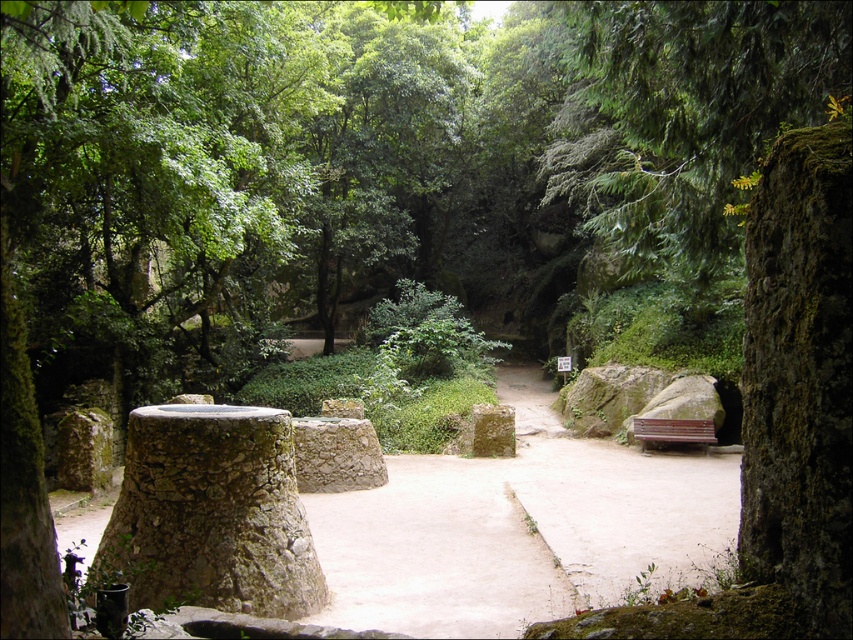
Question: Which of the following is the farthest from the observer?

Choices:
 (A) (509, 408)
 (B) (532, 522)

Answer: (A)

Question: Considering the relative positions of smooth stone path at center and green mossy stone at center in the image provided, where is smooth stone path at center located with respect to green mossy stone at center?

Choices:
 (A) right
 (B) left

Answer: (B)

Question: Observing the image, what is the correct spatial positioning of smooth stone path at center in reference to green mossy stone at center?

Choices:
 (A) above
 (B) below

Answer: (A)

Question: Does smooth stone path at center have a lesser width compared to green mossy stone at center?

Choices:
 (A) yes
 (B) no

Answer: (B)

Question: Which point is closer to the camera taking this photo?

Choices:
 (A) (311, 497)
 (B) (509, 433)

Answer: (A)